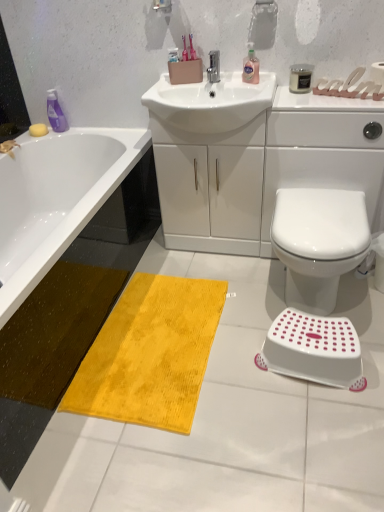
I want to click on vacant space in between white plastic step stool at lower right and yellow plush bath mat at center, so click(253, 359).